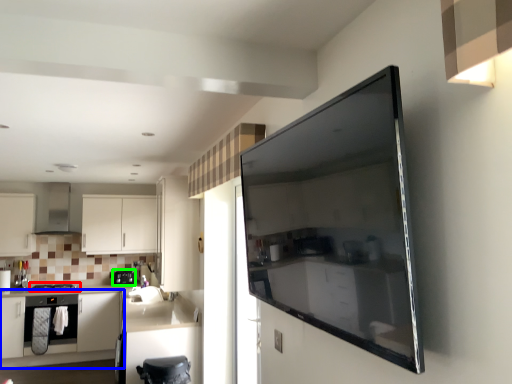
Question: Which is farther away from home appliance (highlighted by a red box)? cabinetry (highlighted by a blue box) or kitchen appliance (highlighted by a green box)?

Choices:
 (A) cabinetry
 (B) kitchen appliance

Answer: (B)